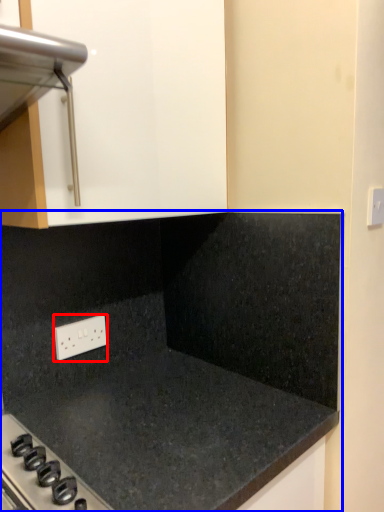
Question: Which object is closer to the camera taking this photo, electric outlet (highlighted by a red box) or countertop (highlighted by a blue box)?

Choices:
 (A) electric outlet
 (B) countertop

Answer: (B)